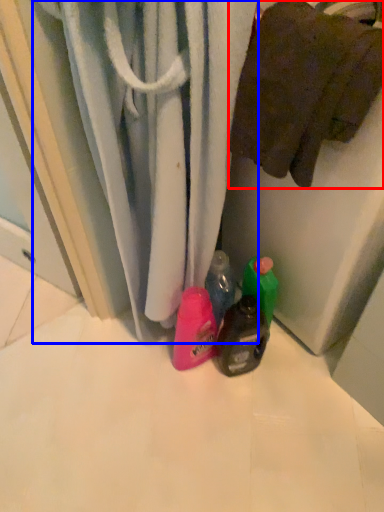
Question: Which of the following is the closest to the observer, towel (highlighted by a red box) or curtain (highlighted by a blue box)?

Choices:
 (A) towel
 (B) curtain

Answer: (B)